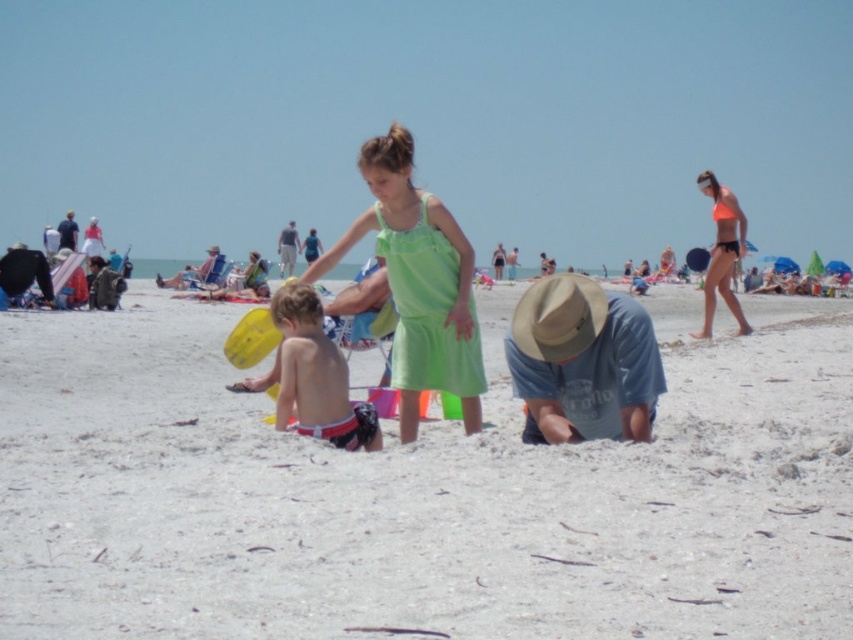
Question: Which object is positioned farthest from the reddish-orange swim trunks at center?

Choices:
 (A) white sandy beach at center
 (B) denim blue shirt at center
 (C) neon orange bikini at right
 (D) green cotton dress at center

Answer: (C)

Question: Does white sandy beach at center have a larger size compared to light blue denim shorts at center?

Choices:
 (A) no
 (B) yes

Answer: (A)

Question: Which of the following is the closest to the observer?

Choices:
 (A) (283, 378)
 (B) (457, 372)
 (C) (587, 426)

Answer: (C)

Question: Where is white sandy beach at center located in relation to neon orange bikini at right in the image?

Choices:
 (A) left
 (B) right

Answer: (A)

Question: From the image, what is the correct spatial relationship of green cotton dress at center in relation to neon orange bikini at right?

Choices:
 (A) left
 (B) right

Answer: (A)

Question: Which point is closer to the camera taking this photo?

Choices:
 (A) (726, 237)
 (B) (355, 433)
 (C) (439, 252)
 (D) (71, 212)

Answer: (B)